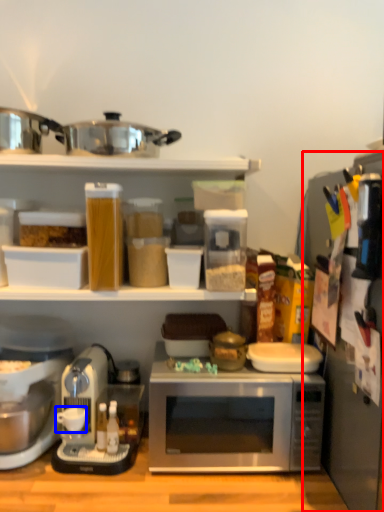
Question: Which of the following is the farthest to the observer, appliance (highlighted by a red box) or coffee cup (highlighted by a blue box)?

Choices:
 (A) appliance
 (B) coffee cup

Answer: (B)